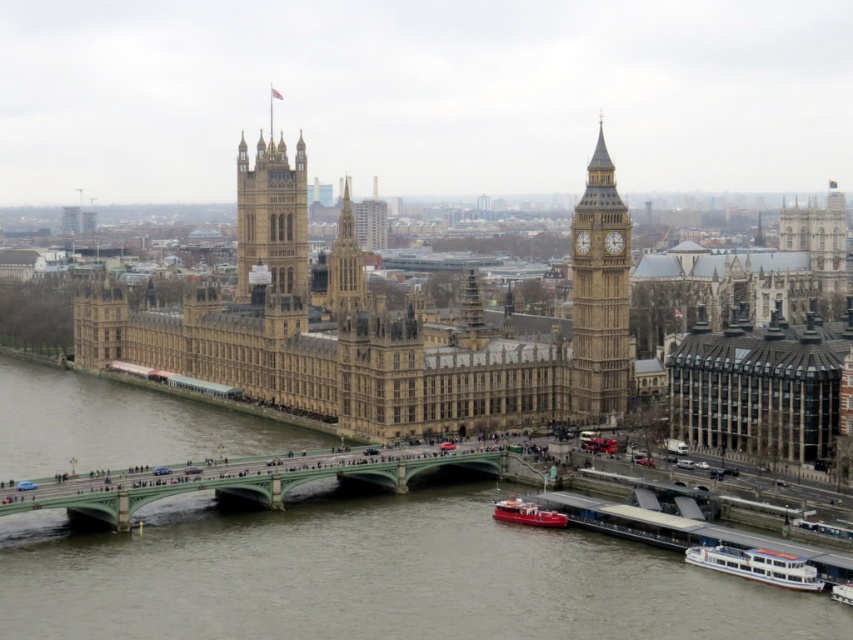
Question: Which object is farther from the camera taking this photo?

Choices:
 (A) metallic red boat at lower center
 (B) golden stone tower at center
 (C) golden stone clock tower at right
 (D) brown stone water at lower center

Answer: (B)

Question: Is green stone bridge at center above metallic red boat at lower center?

Choices:
 (A) yes
 (B) no

Answer: (A)

Question: Considering the relative positions of golden stone tower at center and metallic red boat at lower center in the image provided, where is golden stone tower at center located with respect to metallic red boat at lower center?

Choices:
 (A) above
 (B) below

Answer: (A)

Question: Does white glossy boat at lower right have a smaller size compared to white plastic boat at lower right?

Choices:
 (A) no
 (B) yes

Answer: (A)

Question: Which object appears farthest from the camera in this image?

Choices:
 (A) white glossy boat at lower right
 (B) brown stone water at lower center

Answer: (A)

Question: Which of the following is the closest to the observer?

Choices:
 (A) metallic red boat at lower center
 (B) brown stone water at lower center
 (C) white glossy boat at lower right
 (D) white plastic boat at lower right

Answer: (B)